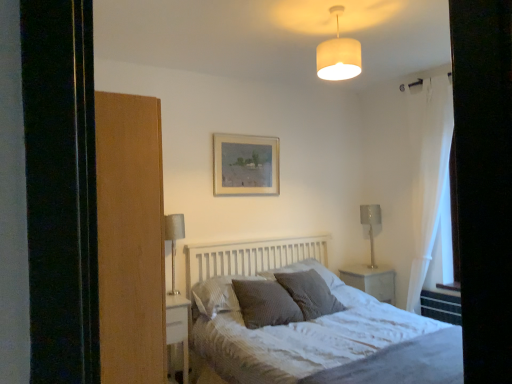
Question: Based on their sizes in the image, would you say textured gray pillow at center, marked as the 2th pillow in a left-to-right arrangement, is bigger or smaller than metallic silver table lamp at right, arranged as the second table lamp when viewed from the front?

Choices:
 (A) small
 (B) big

Answer: (B)

Question: From a real-world perspective, is textured gray pillow at center, marked as the 2th pillow in a left-to-right arrangement, positioned above or below metallic silver table lamp at right, acting as the 1th table lamp starting from the right?

Choices:
 (A) above
 (B) below

Answer: (B)

Question: Which object is positioned closest to the textured gray pillow at center, which is the 2th pillow in right-to-left order?

Choices:
 (A) white wood bed at center
 (B) white sheer curtain at right
 (C) brown wood screen door at left
 (D) dark grey textured pillow at center, the fourth pillow from the right
 (E) textured gray pillow at center, marked as the 2th pillow in a left-to-right arrangement

Answer: (E)

Question: Which is farther from the dark grey textured pillow at center, the fourth pillow from the right?

Choices:
 (A) wooden picture frame at upper center
 (B) brown wood screen door at left
 (C) textured gray pillow at center, marked as the 2th pillow in a left-to-right arrangement
 (D) white fabric lampshade at upper center
 (E) white sheer curtain at right

Answer: (E)